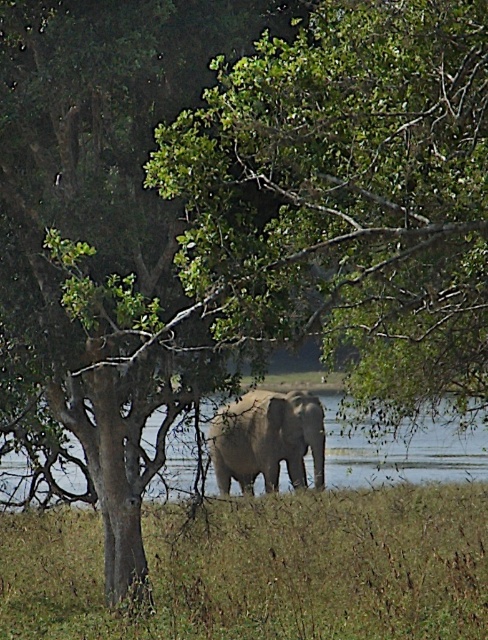
Can you confirm if clear water at elephant center is bigger than gray textured elephant at center?

Answer: Yes.

Is clear water at elephant center below gray textured elephant at center?

Correct, clear water at elephant center is located below gray textured elephant at center.

Between point (471, 428) and point (262, 406), which one is positioned in front?

Point (262, 406) is in front.

Locate an element on the screen. Image resolution: width=488 pixels, height=640 pixels. clear water at elephant center is located at coordinates (402, 452).

Who is shorter, green grassy at lower center or clear water at elephant center?

green grassy at lower center

What do you see at coordinates (264, 568) in the screenshot? This screenshot has width=488, height=640. I see `green grassy at lower center` at bounding box center [264, 568].

Locate an element on the screen. This screenshot has width=488, height=640. green grassy at lower center is located at coordinates (264, 568).

Can you confirm if green grassy at lower center is bigger than gray textured elephant at center?

Yes, green grassy at lower center is bigger than gray textured elephant at center.

Can you confirm if green grassy at lower center is shorter than gray textured elephant at center?

Yes.

Identify the location of green grassy at lower center. Image resolution: width=488 pixels, height=640 pixels. (264, 568).

This screenshot has height=640, width=488. I want to click on green grassy at lower center, so click(264, 568).